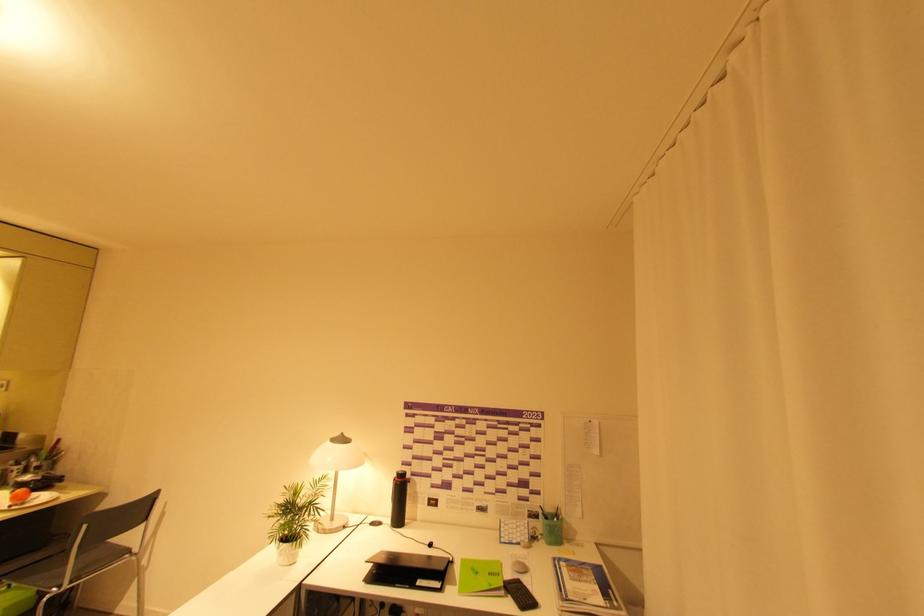
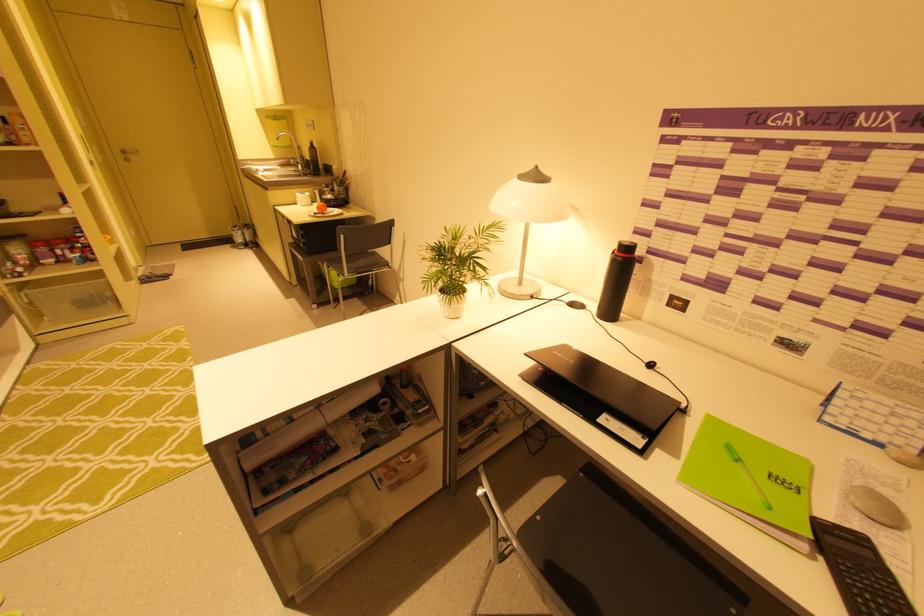
Based on the photo, how did the camera likely rotate?

The camera's rotation is toward left-down.